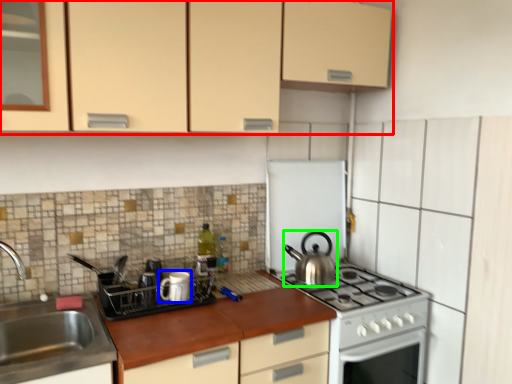
Question: Considering the real-world distances, which object is farthest from cabinetry (highlighted by a red box)? appliance (highlighted by a blue box) or kitchen appliance (highlighted by a green box)?

Choices:
 (A) appliance
 (B) kitchen appliance

Answer: (B)